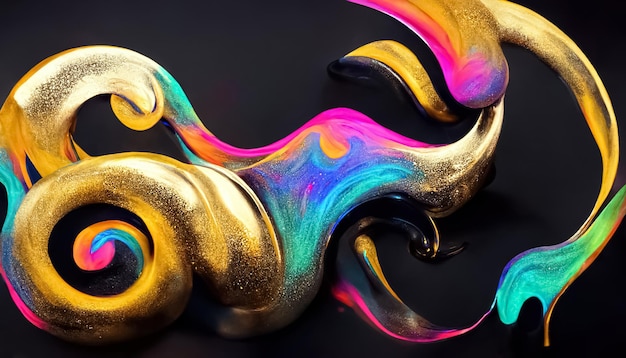
Find the location of `pink paint`. pink paint is located at coordinates (100, 259), (359, 309), (349, 116), (469, 81).